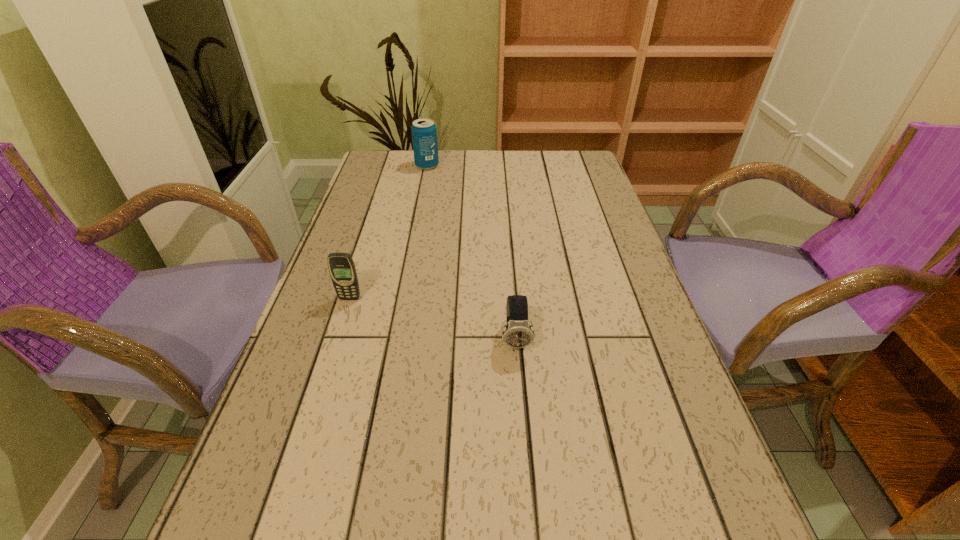
You are a GUI agent. You are given a task and a screenshot of the screen. Output one action in this format:
    pyautogui.click(x=<x>, y=<y>)
    Task: Click on the soda can that is at the left edge
    The height and width of the screenshot is (540, 960).
    Given the screenshot: What is the action you would take?
    pyautogui.click(x=424, y=132)

Find the location of a particular element. cellular telephone present at the left edge is located at coordinates (341, 266).

Where is `object present at the far left corner`? Image resolution: width=960 pixels, height=540 pixels. object present at the far left corner is located at coordinates (424, 132).

Find the location of a particular element. Image resolution: width=960 pixels, height=540 pixels. free region at the far edge of the desktop is located at coordinates (494, 152).

Locate an element on the screen. The height and width of the screenshot is (540, 960). vacant area at the left edge is located at coordinates (360, 296).

This screenshot has height=540, width=960. In the image, there is a desktop. Identify the location of free space at the right edge. (594, 306).

Where is `vacant space at the far right corner of the desktop`? The height and width of the screenshot is (540, 960). vacant space at the far right corner of the desktop is located at coordinates (569, 176).

At what (x,y) coordinates should I click in order to perform the action: click on vacant area that lies between the leftmost object and the farthest object. Please return your answer as a coordinate pair (x, y). Looking at the image, I should click on (389, 232).

At what (x,y) coordinates should I click in order to perform the action: click on free space between the second object from left to right and the leftmost object. Please return your answer as a coordinate pair (x, y). Looking at the image, I should click on (389, 232).

At what (x,y) coordinates should I click in order to perform the action: click on unoccupied area between the second nearest object and the watch. Please return your answer as a coordinate pair (x, y). Looking at the image, I should click on (433, 319).